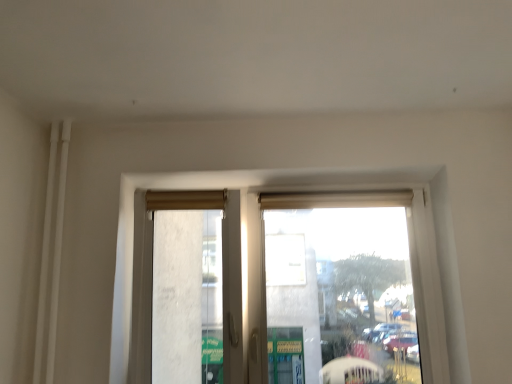
What do you see at coordinates (258, 236) in the screenshot? I see `transparent glass window at center` at bounding box center [258, 236].

At what (x,y) coordinates should I click in order to perform the action: click on transparent glass window at center. Please return your answer as a coordinate pair (x, y). Looking at the image, I should click on (258, 236).

You are a GUI agent. You are given a task and a screenshot of the screen. Output one action in this format:
    pyautogui.click(x=<x>, y=<y>)
    Task: Click on the transparent glass window at center
    The width and height of the screenshot is (512, 384).
    Given the screenshot: What is the action you would take?
    point(258,236)